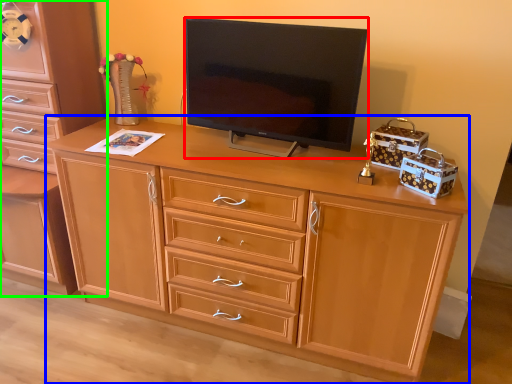
Question: Which is nearer to the television (highlighted by a red box)? desk (highlighted by a blue box) or chest of drawers (highlighted by a green box).

Choices:
 (A) desk
 (B) chest of drawers

Answer: (A)